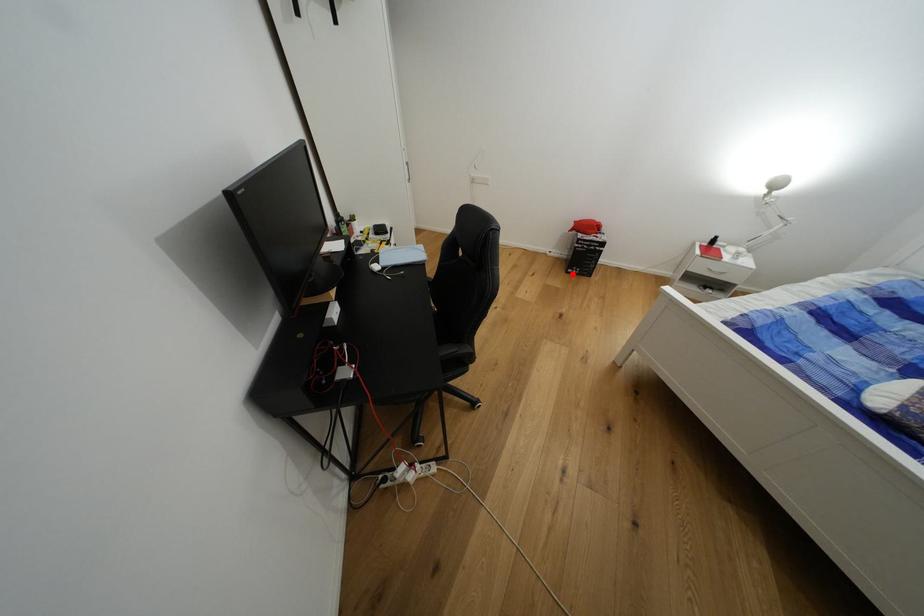
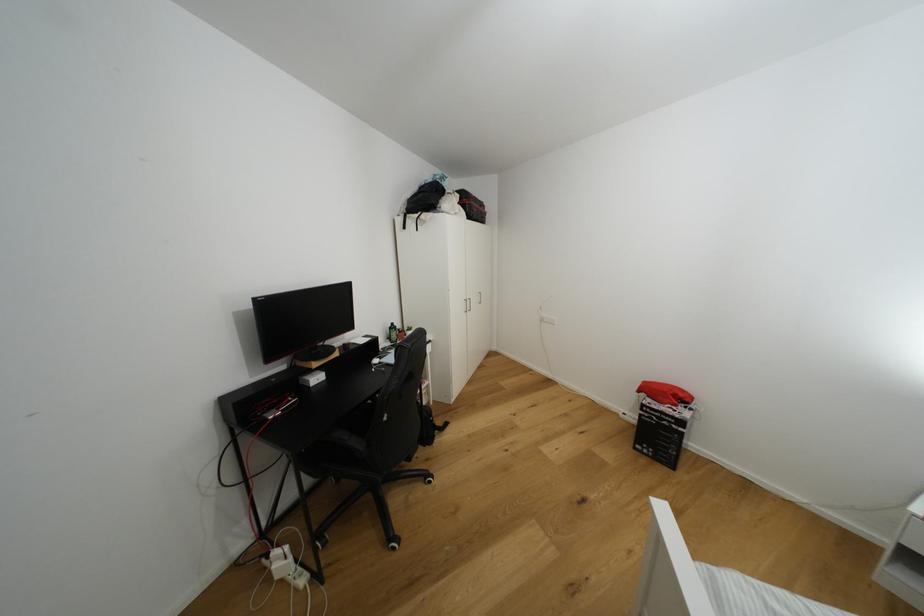
Question: I am providing you with two images of the same scene from different viewpoints. In image1, a red point is highlighted. Considering the same 3D point in image2, which of the following is correct?

Choices:
 (A) It is closer
 (B) It is farther

Answer: (B)